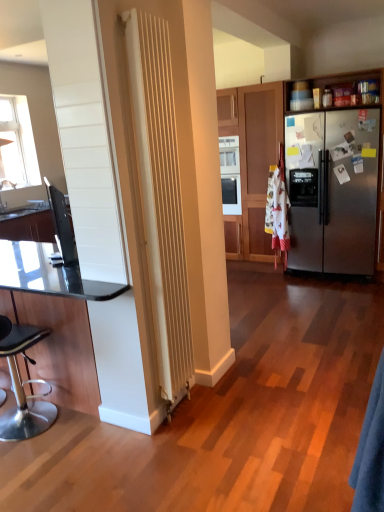
Question: From the image's perspective, is transparent glass table at left on black laminate countertop at left?

Choices:
 (A) yes
 (B) no

Answer: (B)

Question: Does transparent glass table at left have a greater height compared to black laminate countertop at left?

Choices:
 (A) yes
 (B) no

Answer: (A)

Question: Can you confirm if transparent glass table at left is shorter than black laminate countertop at left?

Choices:
 (A) yes
 (B) no

Answer: (B)

Question: Is transparent glass table at left behind black laminate countertop at left?

Choices:
 (A) yes
 (B) no

Answer: (B)

Question: Considering the relative sizes of transparent glass table at left and black laminate countertop at left in the image provided, is transparent glass table at left wider than black laminate countertop at left?

Choices:
 (A) yes
 (B) no

Answer: (A)

Question: Is transparent glass table at left facing towards black laminate countertop at left?

Choices:
 (A) no
 (B) yes

Answer: (A)

Question: Is black glossy tv at left not inside blue fabric robe at lower right?

Choices:
 (A) yes
 (B) no

Answer: (A)

Question: Can you confirm if black glossy tv at left is smaller than blue fabric robe at lower right?

Choices:
 (A) yes
 (B) no

Answer: (A)

Question: Is the position of black glossy tv at left less distant than that of blue fabric robe at lower right?

Choices:
 (A) yes
 (B) no

Answer: (B)

Question: Can you confirm if black glossy tv at left is shorter than blue fabric robe at lower right?

Choices:
 (A) no
 (B) yes

Answer: (B)

Question: Can you confirm if black glossy tv at left is bigger than blue fabric robe at lower right?

Choices:
 (A) no
 (B) yes

Answer: (A)

Question: Can you confirm if black glossy tv at left is thinner than blue fabric robe at lower right?

Choices:
 (A) yes
 (B) no

Answer: (B)

Question: Is black leather stool at lower left bigger than black laminate countertop at left?

Choices:
 (A) yes
 (B) no

Answer: (A)